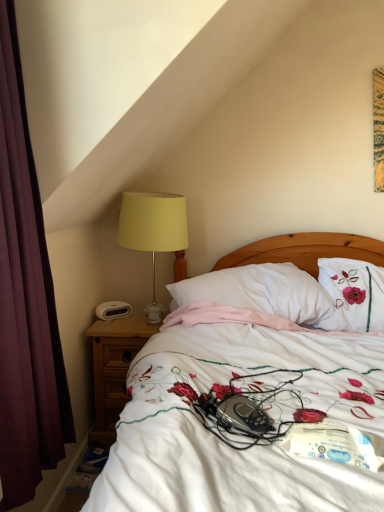
Question: Does white floral bedspread at center contain yellow fabric lampshade at left?

Choices:
 (A) yes
 (B) no

Answer: (A)

Question: Is white floral bedspread at center facing towards yellow fabric lampshade at left?

Choices:
 (A) yes
 (B) no

Answer: (B)

Question: Is white floral bedspread at center not inside yellow fabric lampshade at left?

Choices:
 (A) yes
 (B) no

Answer: (A)

Question: From the image's perspective, is white floral bedspread at center on top of yellow fabric lampshade at left?

Choices:
 (A) yes
 (B) no

Answer: (B)

Question: From a real-world perspective, is white floral bedspread at center over yellow fabric lampshade at left?

Choices:
 (A) yes
 (B) no

Answer: (B)

Question: From a real-world perspective, is white floral bedspread at center positioned above or below white plastic alarm clock at left?

Choices:
 (A) below
 (B) above

Answer: (A)

Question: Considering the positions of point (380, 366) and point (102, 317), is point (380, 366) closer or farther from the camera than point (102, 317)?

Choices:
 (A) closer
 (B) farther

Answer: (A)

Question: In terms of width, does white floral bedspread at center look wider or thinner when compared to white plastic alarm clock at left?

Choices:
 (A) wide
 (B) thin

Answer: (A)

Question: Considering the positions of white floral bedspread at center and white plastic alarm clock at left in the image, is white floral bedspread at center bigger or smaller than white plastic alarm clock at left?

Choices:
 (A) small
 (B) big

Answer: (B)

Question: In terms of width, does brown wooden nightstand at lower left look wider or thinner when compared to yellow fabric lampshade at left?

Choices:
 (A) thin
 (B) wide

Answer: (B)

Question: Is brown wooden nightstand at lower left bigger or smaller than yellow fabric lampshade at left?

Choices:
 (A) small
 (B) big

Answer: (B)

Question: Considering their positions, is brown wooden nightstand at lower left located in front of or behind yellow fabric lampshade at left?

Choices:
 (A) behind
 (B) front

Answer: (A)

Question: From a real-world perspective, is brown wooden nightstand at lower left positioned above or below yellow fabric lampshade at left?

Choices:
 (A) below
 (B) above

Answer: (A)

Question: Which is correct: maroon fabric curtain at left is inside white plastic alarm clock at left, or outside of it?

Choices:
 (A) inside
 (B) outside

Answer: (B)

Question: From the image's perspective, is maroon fabric curtain at left above or below white plastic alarm clock at left?

Choices:
 (A) below
 (B) above

Answer: (B)